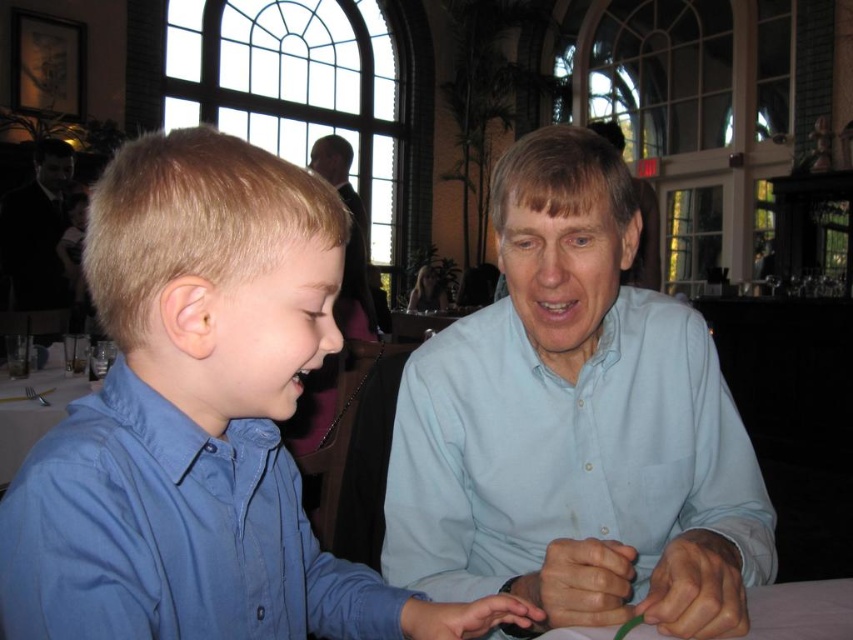
Describe the element at coordinates (200, 422) in the screenshot. I see `blue cotton shirt at left` at that location.

Is point (238, 344) positioned after point (47, 381)?

No, it is not.

Locate an element on the screen. blue cotton shirt at left is located at coordinates (200, 422).

Does blue cotton shirt at left appear over green plastic table at center?

Yes, blue cotton shirt at left is above green plastic table at center.

Who is positioned more to the right, blue cotton shirt at left or green plastic table at center?

green plastic table at center is more to the right.

Who is more distant from viewer, (x=1, y=545) or (x=770, y=614)?

Point (x=770, y=614)

Image resolution: width=853 pixels, height=640 pixels. In order to click on blue cotton shirt at left in this screenshot , I will do `click(200, 422)`.

Who is shorter, green plastic table at center or white glossy table at lower left?

→ Standing shorter between the two is green plastic table at center.

Between green plastic table at center and white glossy table at lower left, which one has more height?

white glossy table at lower left is taller.

Measure the distance between point (833,602) and camera.

36.43 inches

Where is `green plastic table at center`? Image resolution: width=853 pixels, height=640 pixels. green plastic table at center is located at coordinates (799, 611).